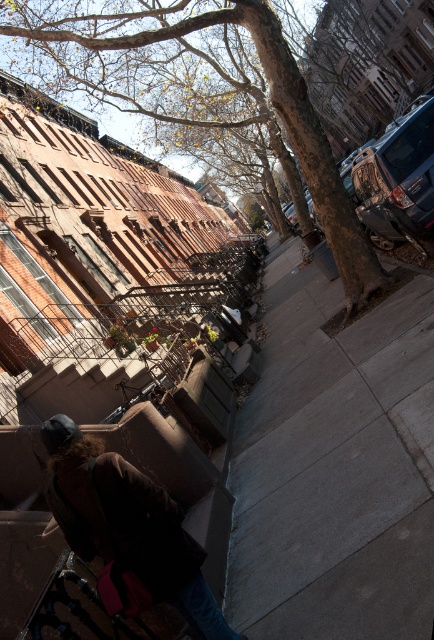
You are a delivery drone flying over an urban area and need to land on the sidewalk near the brown textured tree at upper center. According to the coordinates provided, where should you aim to land?

The brown textured tree at upper center is located at coordinates point (167, 49), so you should aim to land near that point.

You are standing on the sidewalk and want to take a photo of both point (314, 627) and point (99, 525) in the scene. Which point should you focus on first to ensure both are in clear view?

You should focus on point (314, 627) first because it is closer to the camera than point (99, 525). This ensures both points will be in focus when using a camera with a fixed focal plane.

You are a delivery person who needs to avoid stepping on the sidewalk cracks. You see the gray concrete sidewalk at center and the brown textured tree at upper center. Which object is directly above the other?

The brown textured tree at upper center is directly above the gray concrete sidewalk at center.